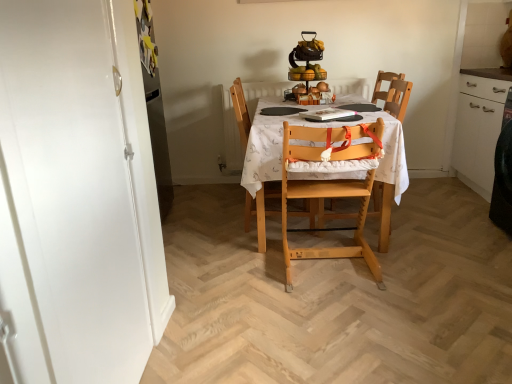
Identify the location of free space in front of white printed fabric at center. (330, 305).